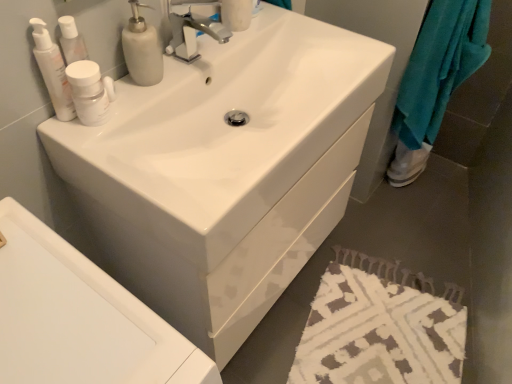
Where is `free spot below teal plush towel at right (from a real-world perspective)`? This screenshot has height=384, width=512. free spot below teal plush towel at right (from a real-world perspective) is located at coordinates (x=394, y=203).